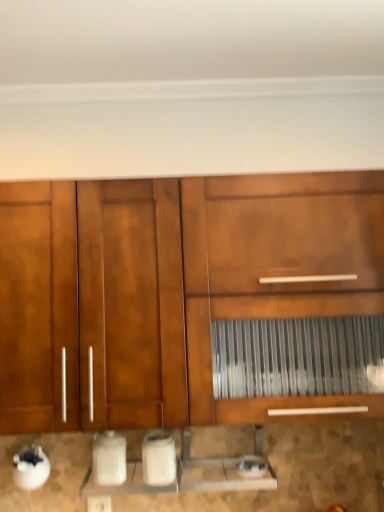
Question: Does white plastic electric outlet at lower center have a greater width compared to matte wood cabinet at center?

Choices:
 (A) no
 (B) yes

Answer: (A)

Question: Does white plastic electric outlet at lower center have a smaller size compared to matte wood cabinet at center?

Choices:
 (A) no
 (B) yes

Answer: (B)

Question: Is the depth of white plastic electric outlet at lower center greater than that of matte wood cabinet at center?

Choices:
 (A) yes
 (B) no

Answer: (A)

Question: Is white plastic electric outlet at lower center to the left of matte wood cabinet at center from the viewer's perspective?

Choices:
 (A) yes
 (B) no

Answer: (A)

Question: Can you confirm if white plastic electric outlet at lower center is shorter than matte wood cabinet at center?

Choices:
 (A) yes
 (B) no

Answer: (A)

Question: Relative to white glossy toaster at lower center, which appears as the 2th appliance when viewed from the left, is satin silver toaster at lower center, which is the 3th appliance from left to right, in front or behind?

Choices:
 (A) front
 (B) behind

Answer: (B)

Question: Would you say satin silver toaster at lower center, which is counted as the 1th appliance, starting from the right, is inside or outside white glossy toaster at lower center, which appears as the 2th appliance when viewed from the left?

Choices:
 (A) outside
 (B) inside

Answer: (A)

Question: From a real-world perspective, relative to white glossy toaster at lower center, which is counted as the second appliance, starting from the right, is satin silver toaster at lower center, which is counted as the 1th appliance, starting from the right, vertically above or below?

Choices:
 (A) above
 (B) below

Answer: (B)

Question: Is satin silver toaster at lower center, which is the 3th appliance from left to right, wider or thinner than white glossy toaster at lower center, which appears as the 2th appliance when viewed from the left?

Choices:
 (A) thin
 (B) wide

Answer: (A)

Question: Considering the positions of matte wood cabinet at center and white glossy toaster at lower center, which appears as the 2th appliance when viewed from the left, in the image, is matte wood cabinet at center taller or shorter than white glossy toaster at lower center, which appears as the 2th appliance when viewed from the left,?

Choices:
 (A) short
 (B) tall

Answer: (B)

Question: Is matte wood cabinet at center in front of or behind white glossy toaster at lower center, which appears as the 2th appliance when viewed from the left, in the image?

Choices:
 (A) front
 (B) behind

Answer: (A)

Question: Is point (99, 331) closer or farther from the camera than point (157, 477)?

Choices:
 (A) farther
 (B) closer

Answer: (B)

Question: From the image's perspective, is matte wood cabinet at center located above or below white glossy toaster at lower center, which is counted as the second appliance, starting from the right?

Choices:
 (A) below
 (B) above

Answer: (B)

Question: In terms of size, does matte wood cabinet at center appear bigger or smaller than satin silver toaster at lower center, which is counted as the 1th appliance, starting from the right?

Choices:
 (A) small
 (B) big

Answer: (B)

Question: From a real-world perspective, is matte wood cabinet at center positioned above or below satin silver toaster at lower center, which is the 3th appliance from left to right?

Choices:
 (A) above
 (B) below

Answer: (A)